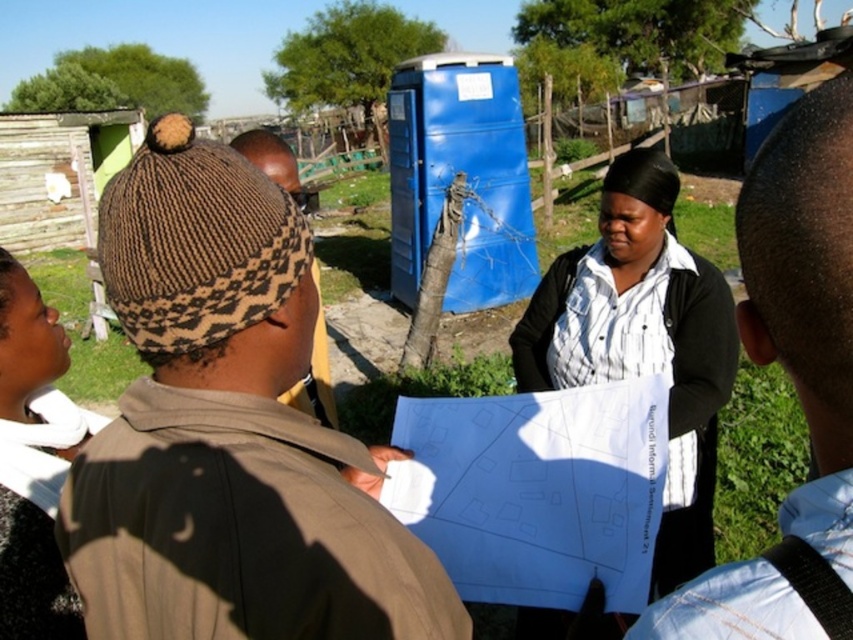
Which of these two, brown knitted hat at upper left or light blue shirt at upper right, stands taller?

light blue shirt at upper right is taller.

Which is in front, point (97, 512) or point (778, 548)?

Point (778, 548) is in front.

What are the coordinates of `brown knitted hat at upper left` in the screenshot? It's located at (229, 432).

Who is higher up, brown knitted hat at upper left or white striped shirt at center?

brown knitted hat at upper left is higher up.

In the scene shown: Is brown knitted hat at upper left below white striped shirt at center?

Incorrect, brown knitted hat at upper left is not positioned below white striped shirt at center.

Does point (175, 584) come closer to viewer compared to point (566, 321)?

Yes, it is in front of point (566, 321).

This screenshot has width=853, height=640. I want to click on brown knitted hat at upper left, so click(229, 432).

Is light blue shirt at upper right positioned before black knit hat at upper left?

That is True.

Is light blue shirt at upper right thinner than black knit hat at upper left?

In fact, light blue shirt at upper right might be wider than black knit hat at upper left.

Locate an element on the screen. The height and width of the screenshot is (640, 853). light blue shirt at upper right is located at coordinates (793, 381).

Locate an element on the screen. light blue shirt at upper right is located at coordinates (793, 381).